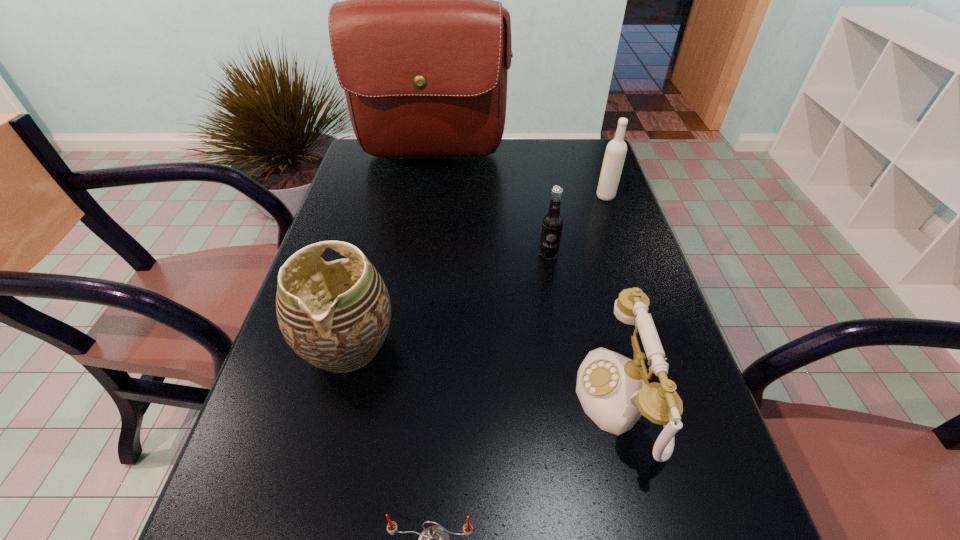
Point out which object is positioned as the fourth nearest to the telephone. Please provide its 2D coordinates. Your answer should be formatted as a tuple, i.e. [(x, y)], where the tuple contains the x and y coordinates of a point satisfying the conditions above.

[(616, 150)]

This screenshot has height=540, width=960. Identify the location of free space that satisfies the following two spatial constraints: 1. on the front side of the fifth nearest object; 2. on the dial of the telephone. (677, 400).